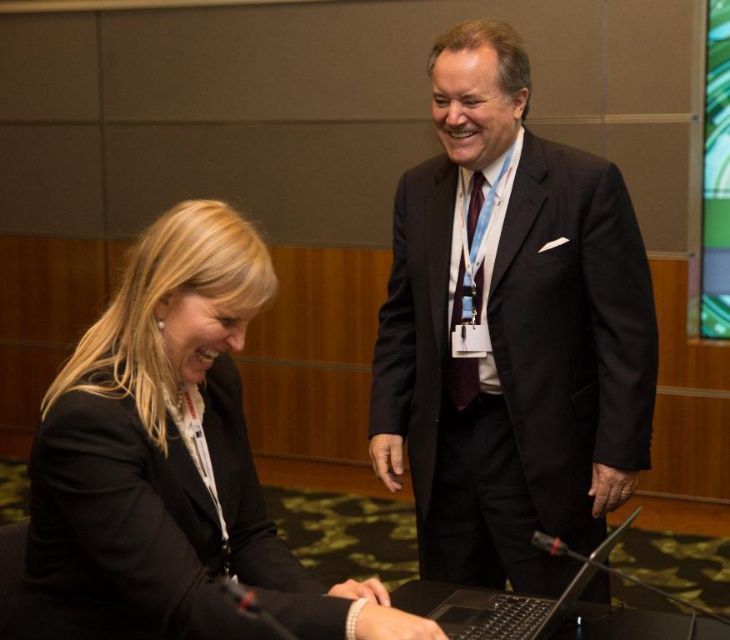
You are organizing a professional event and need to arrange seating for two attendees. One is wearing a dark suit at center and the other a black matte suit at lower left. Based on their positions in the image, which attendee should be seated to the right of the other?

The dark suit at center should be seated to the right of the black matte suit at lower left because the dark suit at center is positioned on the right side of black matte suit at lower left in the image.

You are a photographer setting up for a group photo in the room. You need to ensure that the dark suit at center and the black plastic laptop at lower center are both visible in the frame. Given their sizes, which object should you prioritize positioning closer to the camera to ensure clarity?

The dark suit at center is taller than the black plastic laptop at lower center, so to ensure clarity, prioritize positioning the dark suit at center closer to the camera since it is larger and might need more focus.